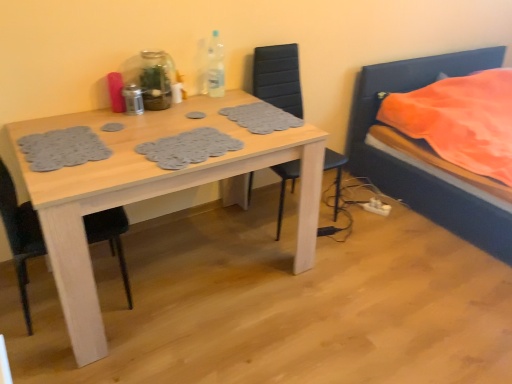
Identify the location of vacant area that is situated to the right of metallic silver shaker at table center, the 3th bottle positioned from the right. The image size is (512, 384). (162, 114).